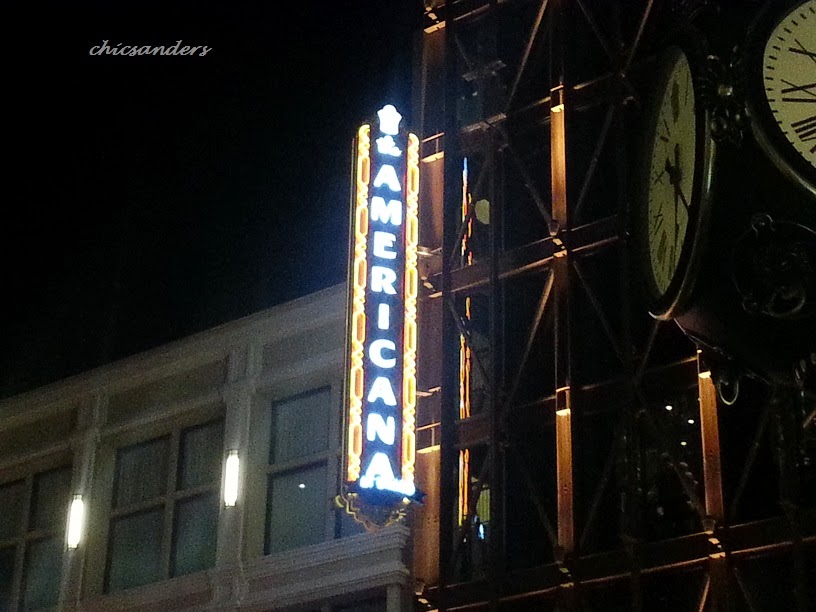
Locate an element on the screen. The width and height of the screenshot is (816, 612). clock is located at coordinates (667, 224).